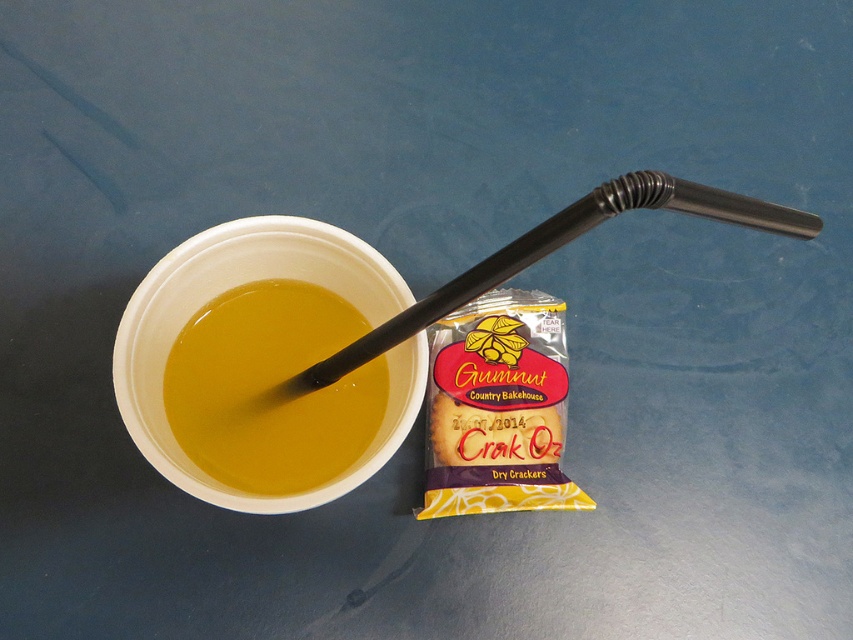
You are setting up a small table for a tea party. You have a yellow matte liquid at center and a black plastic straw at upper center. Which object takes up more horizontal space on the table?

The black plastic straw at upper center takes up more horizontal space on the table because the yellow matte liquid at center has a lesser width compared to it.

You are a person who just entered the room and see the yellow matte liquid at center and the black plastic straw at upper center. Which object is positioned higher in the image?

The black plastic straw at upper center is positioned higher than the yellow matte liquid at center.

Based on the photo, you are a customer at a cafe and see the yellow matte liquid at center and the black plastic straw at upper center in your drink. If you want to drink from the straw, which direction should you tilt your cup towards?

You should tilt the cup towards the black plastic straw at upper center because the yellow matte liquid at center is to the left of the straw, so tilting towards the straw will allow the liquid to flow into it.